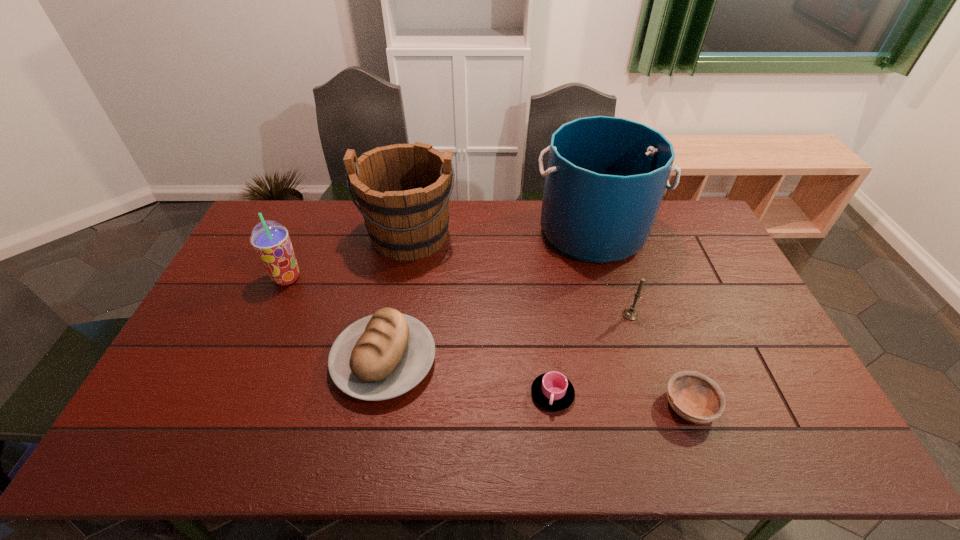
Locate an element on the screen. empty location between the bowl and the smoothie is located at coordinates (489, 342).

The height and width of the screenshot is (540, 960). Identify the location of empty space between the candle and the cup. (591, 354).

Where is `free space between the fifth shortest object and the candle`? The width and height of the screenshot is (960, 540). free space between the fifth shortest object and the candle is located at coordinates (459, 296).

This screenshot has height=540, width=960. In order to click on free area in between the candle and the bucket in this screenshot , I will do `click(612, 273)`.

Locate an element on the screen. This screenshot has height=540, width=960. the fifth closest object to the wine bucket is located at coordinates (630, 313).

Find the location of a particular element. Image resolution: width=960 pixels, height=540 pixels. the third closest object to the candle is located at coordinates (552, 391).

Identify the location of free space that satisfies the following two spatial constraints: 1. on the side of the candle with the handle for carrying; 2. on the right side of the wine bucket. (396, 315).

The height and width of the screenshot is (540, 960). Find the location of `free region that satisfies the following two spatial constraints: 1. on the back side of the bread; 2. on the left side of the bucket`. free region that satisfies the following two spatial constraints: 1. on the back side of the bread; 2. on the left side of the bucket is located at coordinates (408, 232).

The width and height of the screenshot is (960, 540). I want to click on vacant position in the image that satisfies the following two spatial constraints: 1. on the side with the handle of the bowl; 2. on the right side of the cup, so click(554, 405).

Where is `vacant space that satisfies the following two spatial constraints: 1. on the front side of the smoothie; 2. on the left side of the candle`? This screenshot has height=540, width=960. vacant space that satisfies the following two spatial constraints: 1. on the front side of the smoothie; 2. on the left side of the candle is located at coordinates (271, 315).